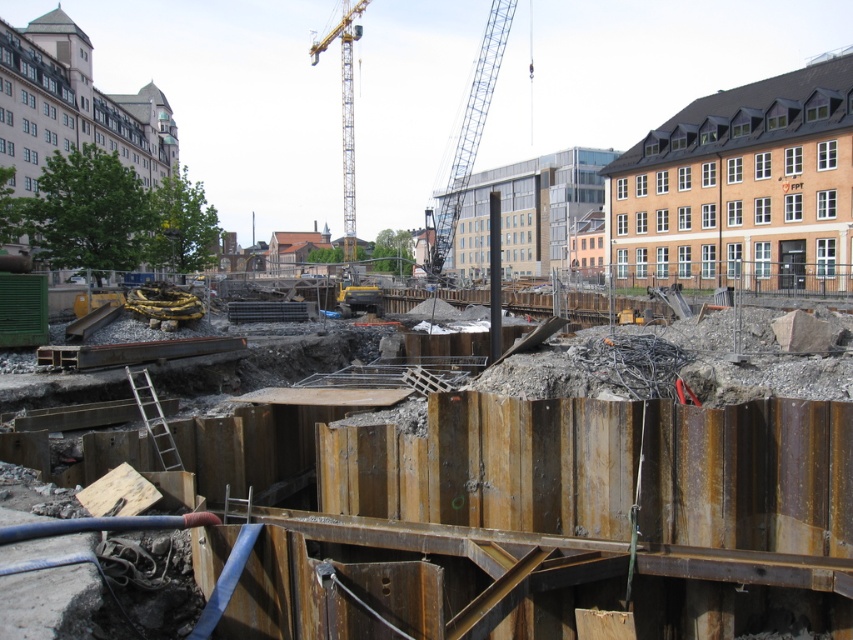
Can you confirm if blue metallic crane at center is wider than yellow metallic crane at upper center?

In fact, blue metallic crane at center might be narrower than yellow metallic crane at upper center.

Can you confirm if blue metallic crane at center is positioned below yellow metallic crane at upper center?

Actually, blue metallic crane at center is above yellow metallic crane at upper center.

Locate an element on the screen. The width and height of the screenshot is (853, 640). blue metallic crane at center is located at coordinates (468, 134).

From the picture: Can you confirm if rusty metal sheet at center is positioned to the right of yellow metallic crane at upper center?

Correct, you'll find rusty metal sheet at center to the right of yellow metallic crane at upper center.

Is rusty metal sheet at center shorter than yellow metallic crane at upper center?

Yes, rusty metal sheet at center is shorter than yellow metallic crane at upper center.

Does point (289, 557) lie in front of point (350, 234)?

Yes, point (289, 557) is in front of point (350, 234).

Find the location of a particular element. The width and height of the screenshot is (853, 640). rusty metal sheet at center is located at coordinates (544, 515).

The image size is (853, 640). Describe the element at coordinates (544, 515) in the screenshot. I see `rusty metal sheet at center` at that location.

In the scene shown: Who is higher up, rusty metal sheet at center or blue metallic crane at center?

Positioned higher is blue metallic crane at center.

The height and width of the screenshot is (640, 853). Describe the element at coordinates (544, 515) in the screenshot. I see `rusty metal sheet at center` at that location.

Image resolution: width=853 pixels, height=640 pixels. I want to click on rusty metal sheet at center, so click(x=544, y=515).